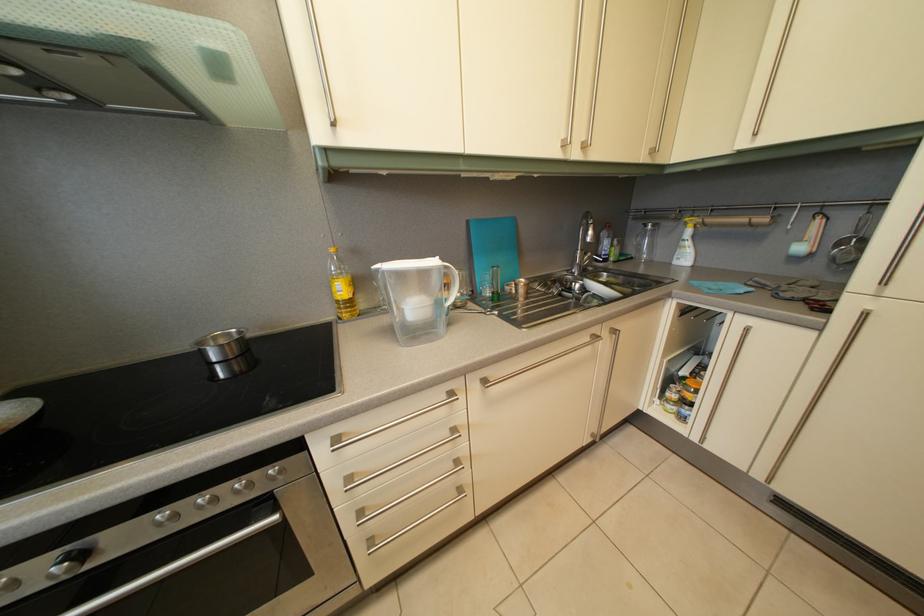
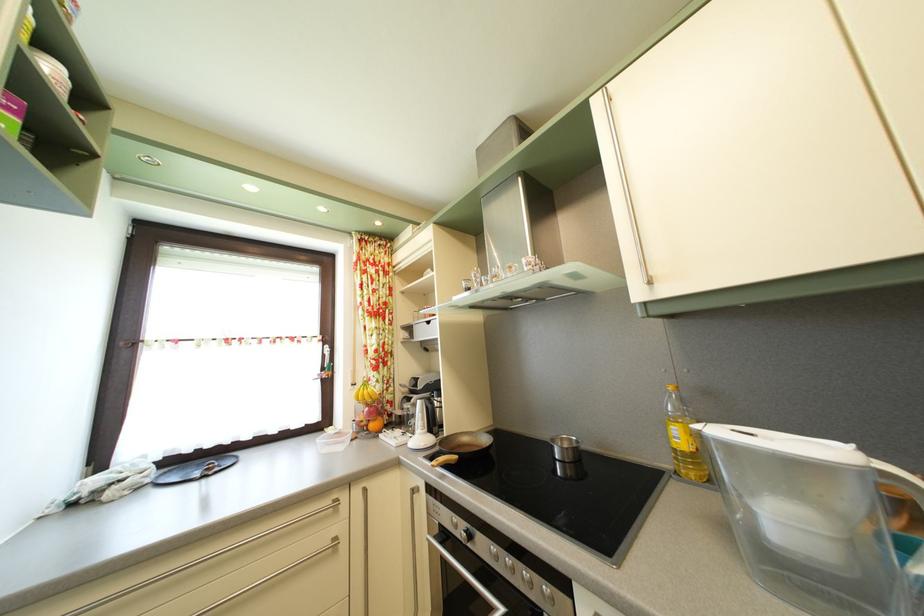
In the second image, find the point that corresponds to the point at 341,257 in the first image.

(678, 395)